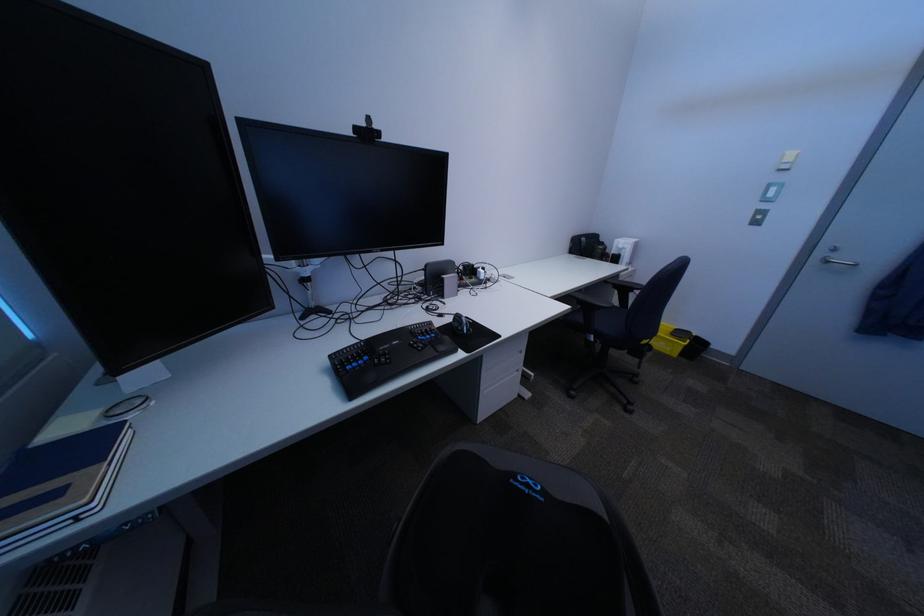
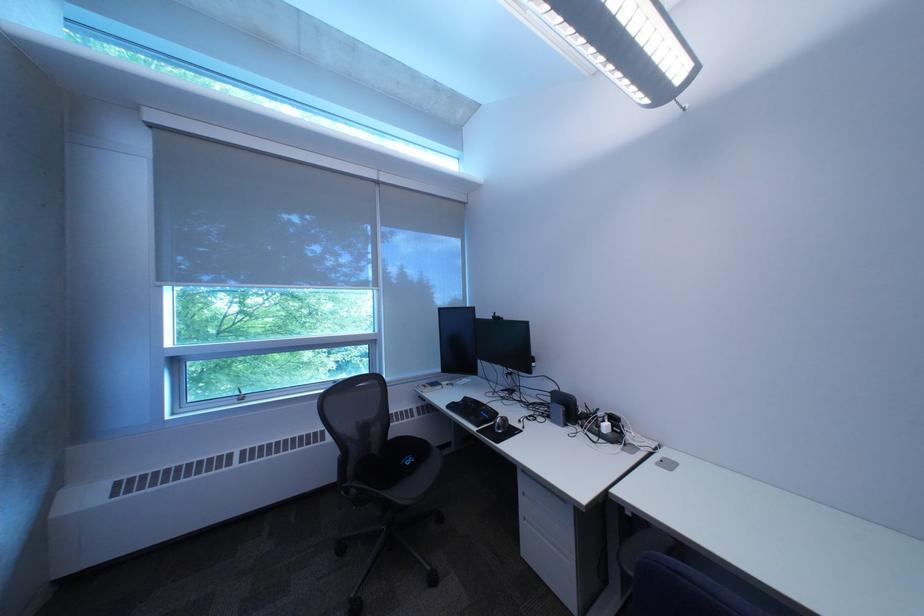
Where in the second image is the point corresponding to the point at 471,353 from the first image?

(492, 429)